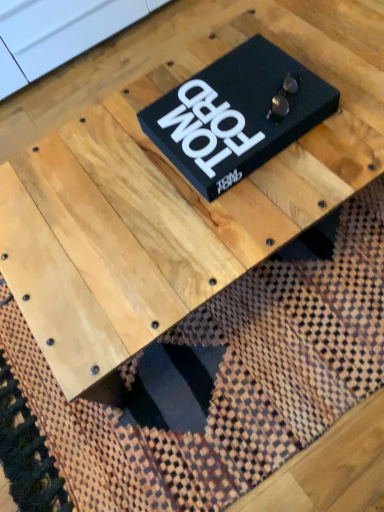
Identify the location of free region on the left part of black matte book at center. (109, 177).